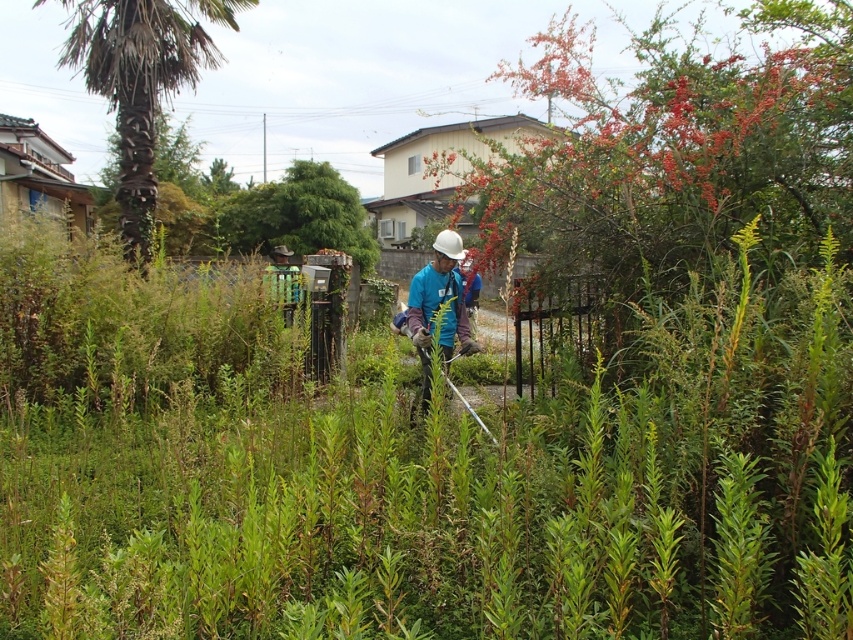
Based on the photo, you are a gardener who needs to reach the blue fabric at center to retrieve a tool. Which direction should you move from the green leafy palm at left to get there?

Move to the right from the green leafy palm at left to reach the blue fabric at center since the palm is to the left of the blue fabric.

You are a landscape worker who needs to place a 20 feet long safety barrier between the green leafy palm at left and the blue fabric at center. Is there enough space to place it without overlapping either object?

The distance between the green leafy palm at left and the blue fabric at center is 30.65 feet. Since the safety barrier is 20 feet long, there is sufficient space to place it between them without overlapping either object.

You are a gardener trying to decide which area to tackle first. Based on the image, which object takes up more horizontal space between the green leafy palm at left and the blue fabric at center?

The green leafy palm at left takes up more horizontal space than the blue fabric at center because its width is larger.